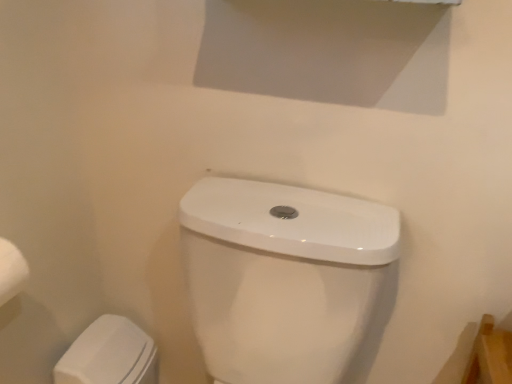
Question: Considering their positions, is white glossy toilet at lower center located in front of or behind white glossy porcelain at lower left?

Choices:
 (A) front
 (B) behind

Answer: (A)

Question: Choose the correct answer: Is white glossy toilet at lower center inside white glossy porcelain at lower left or outside it?

Choices:
 (A) inside
 (B) outside

Answer: (B)

Question: Considering the positions of white glossy toilet at lower center and white glossy porcelain at lower left in the image, is white glossy toilet at lower center wider or thinner than white glossy porcelain at lower left?

Choices:
 (A) wide
 (B) thin

Answer: (A)

Question: From the image's perspective, is white glossy porcelain at lower left above or below white glossy toilet at lower center?

Choices:
 (A) below
 (B) above

Answer: (A)

Question: Looking at the image, does white glossy porcelain at lower left seem bigger or smaller compared to white glossy toilet at lower center?

Choices:
 (A) big
 (B) small

Answer: (B)

Question: From their relative heights in the image, would you say white glossy porcelain at lower left is taller or shorter than white glossy toilet at lower center?

Choices:
 (A) tall
 (B) short

Answer: (B)

Question: Is white glossy porcelain at lower left wider or thinner than white glossy toilet at lower center?

Choices:
 (A) thin
 (B) wide

Answer: (A)